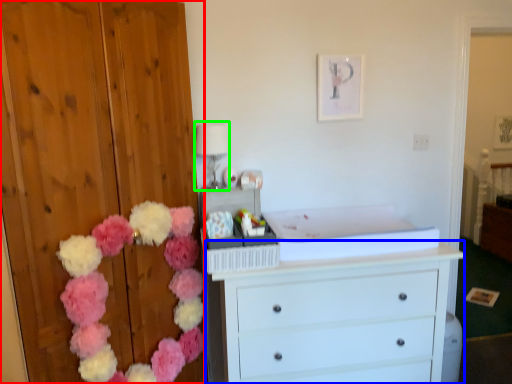
Question: Which object is positioned closest to dresser (highlighted by a red box)? Select from chest of drawers (highlighted by a blue box) and lamp (highlighted by a green box).

Choices:
 (A) chest of drawers
 (B) lamp

Answer: (B)